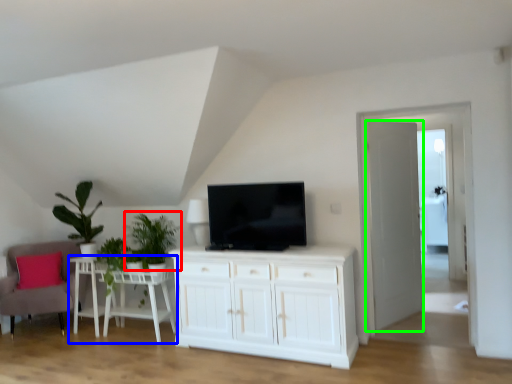
Question: Estimate the real-world distances between objects in this image. Which object is closer to plant (highlighted by a red box), table (highlighted by a blue box) or door (highlighted by a green box)?

Choices:
 (A) table
 (B) door

Answer: (A)